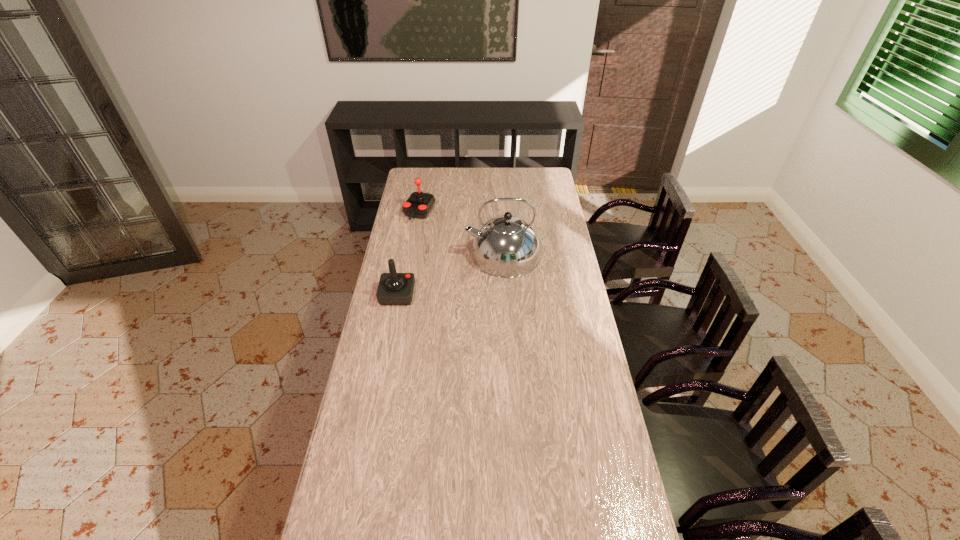
You are a GUI agent. You are given a task and a screenshot of the screen. Output one action in this format:
    pyautogui.click(x=<x>, y=<y>)
    Task: Click on the free space at the left edge of the desktop
    The width and height of the screenshot is (960, 540).
    Given the screenshot: What is the action you would take?
    pyautogui.click(x=422, y=232)

The image size is (960, 540). I want to click on vacant space at the right edge of the desktop, so click(x=628, y=504).

The width and height of the screenshot is (960, 540). Identify the location of free space at the far left corner. (416, 184).

The height and width of the screenshot is (540, 960). What are the coordinates of `vacant area at the far right corner of the desktop` in the screenshot? It's located at (531, 185).

Find the location of `free space that is in between the farthest object and the nearest object`. free space that is in between the farthest object and the nearest object is located at coordinates (408, 253).

Identify the location of free space between the farther joystick and the nearer joystick. (408, 253).

Image resolution: width=960 pixels, height=540 pixels. What are the coordinates of `vacant area that lies between the farthest object and the nearer joystick` in the screenshot? It's located at (408, 253).

Find the location of a particular element. vacant area between the rightmost object and the farther joystick is located at coordinates (461, 234).

Where is `empty space between the nearer joystick and the farther joystick`? empty space between the nearer joystick and the farther joystick is located at coordinates (408, 253).

Locate which object ranks second in proximity to the farther joystick. Please provide its 2D coordinates. Your answer should be formatted as a tuple, i.e. [(x, y)], where the tuple contains the x and y coordinates of a point satisfying the conditions above.

[(394, 288)]